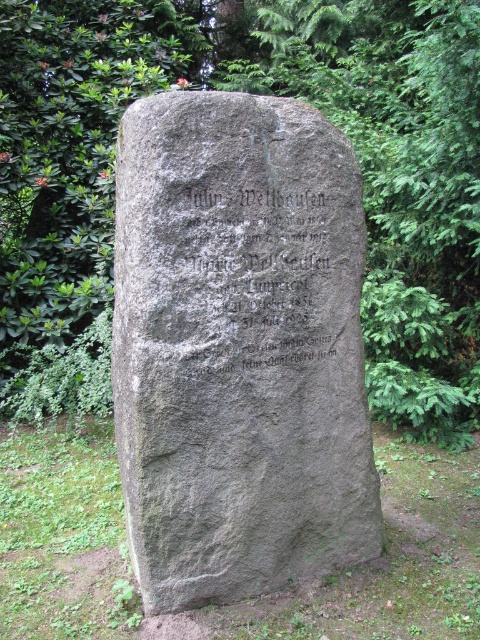
Question: Among these objects, which one is nearest to the camera?

Choices:
 (A) dark gray stone inscription at center
 (B) green leafy tree at upper center

Answer: (A)

Question: Can you confirm if green leafy tree at upper center is positioned below dark gray stone inscription at center?

Choices:
 (A) yes
 (B) no

Answer: (B)

Question: Does green leafy tree at upper center have a larger size compared to gray stone gravestone at center?

Choices:
 (A) no
 (B) yes

Answer: (B)

Question: Which point is closer to the camera?

Choices:
 (A) (239, 180)
 (B) (406, 131)
 (C) (323, 216)

Answer: (A)

Question: Can you confirm if green leafy tree at upper center is smaller than gray stone gravestone at center?

Choices:
 (A) no
 (B) yes

Answer: (A)

Question: Among these objects, which one is nearest to the camera?

Choices:
 (A) gray stone gravestone at center
 (B) dark gray stone inscription at center

Answer: (A)